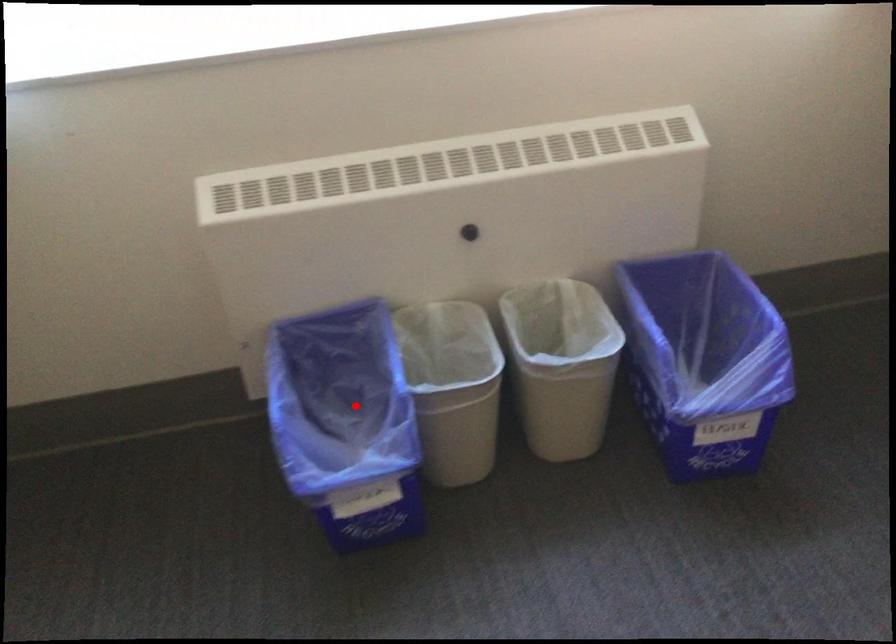
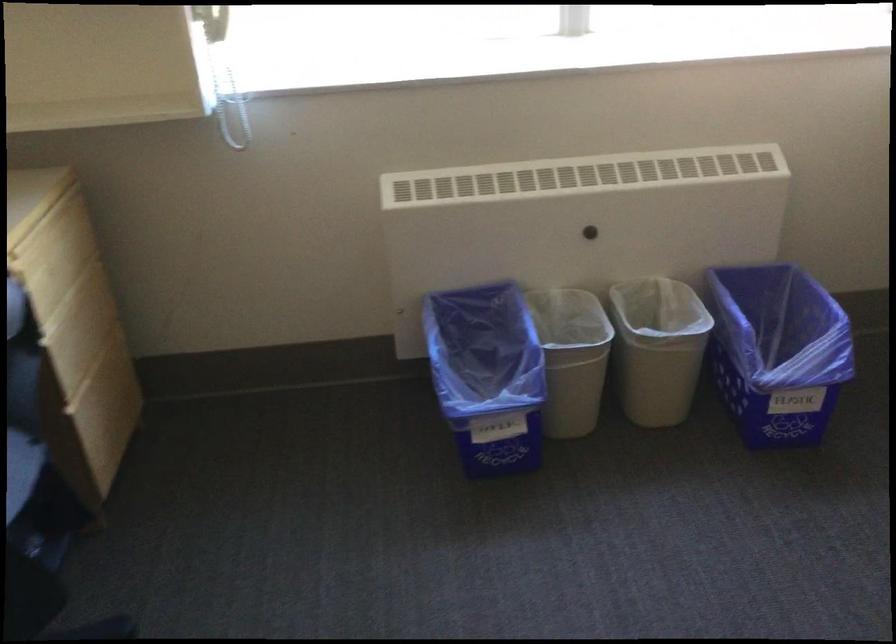
In the second image, find the point that corresponds to the highlighted location in the first image.

(485, 364)